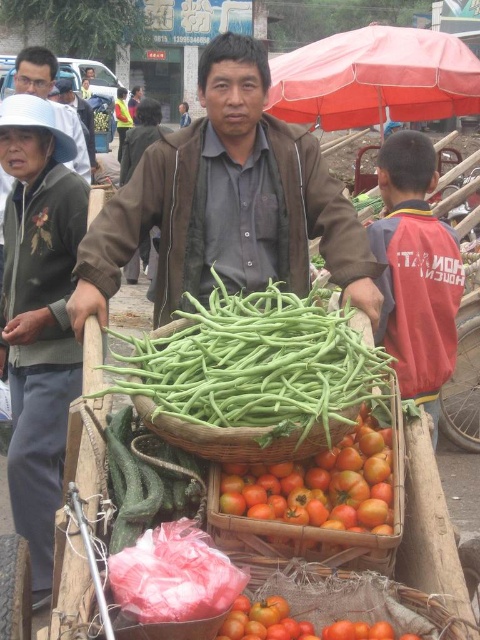
Question: Which point is closer to the camera taking this photo?

Choices:
 (A) (408, 237)
 (B) (93, 134)
 (C) (37, 163)

Answer: (A)

Question: Observing the image, what is the correct spatial positioning of brown cotton shirt at center in reference to matte gray shirt at upper center?

Choices:
 (A) left
 (B) right

Answer: (B)

Question: Which point is farther to the camera?

Choices:
 (A) (228, 372)
 (B) (441, 256)
 (C) (242, 115)
 (D) (122, 164)

Answer: (D)

Question: Does red cotton jacket at right appear under brown cotton shirt at center?

Choices:
 (A) no
 (B) yes

Answer: (B)

Question: Which object appears closest to the camera in this image?

Choices:
 (A) matte gray shirt at upper center
 (B) brown cotton shirt at center
 (C) green matte hat at upper left

Answer: (C)

Question: Can you confirm if green matte cucumber at lower left is positioned above shiny red tomato at lower center?

Choices:
 (A) yes
 (B) no

Answer: (A)